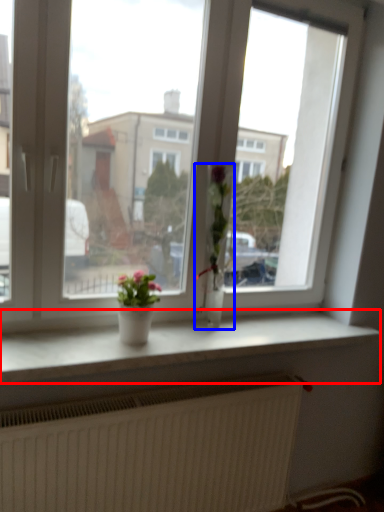
Question: Which object appears closest to the camera in this image, window sill (highlighted by a red box) or houseplant (highlighted by a blue box)?

Choices:
 (A) window sill
 (B) houseplant

Answer: (A)